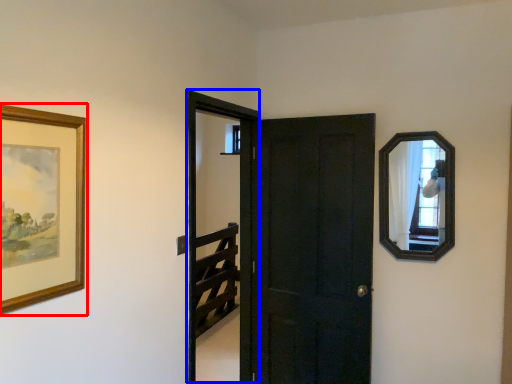
Question: Which of the following is the closest to the observer, picture frame (highlighted by a red box) or screen door (highlighted by a blue box)?

Choices:
 (A) picture frame
 (B) screen door

Answer: (A)